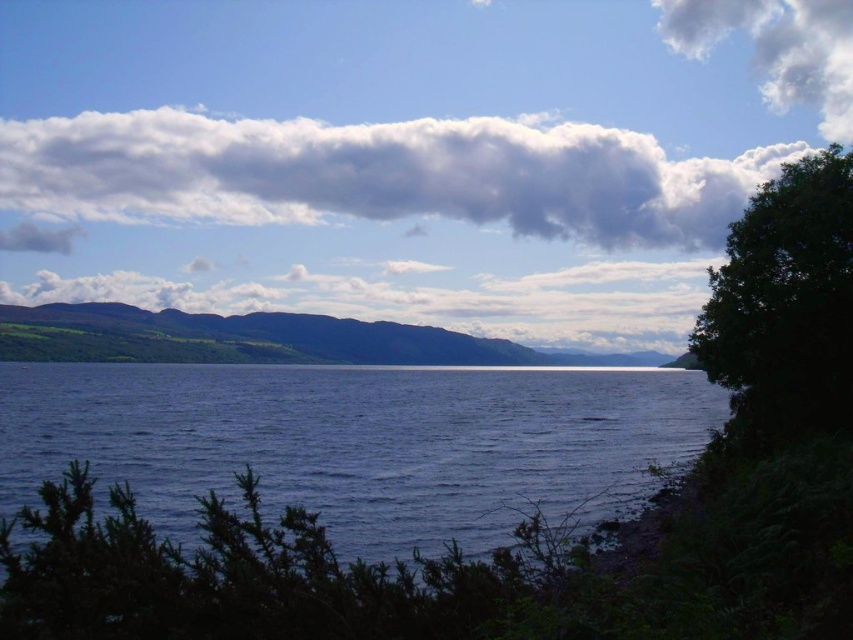
Who is positioned more to the left, cloudy sky at upper center or green leafy tree at right?

cloudy sky at upper center

Which of these two, cloudy sky at upper center or green leafy tree at right, stands taller?

With more height is cloudy sky at upper center.

Measure the distance between point (503,134) and camera.

Point (503,134) and camera are 1209.71 feet apart.

In order to click on cloudy sky at upper center in this screenshot , I will do `click(378, 173)`.

How distant is dark blue water at center from white fluffy cloud at upper right?

dark blue water at center and white fluffy cloud at upper right are 928.90 feet apart from each other.

From the picture: Between dark blue water at center and white fluffy cloud at upper right, which one is positioned higher?

white fluffy cloud at upper right is above.

Which is behind, point (334, 476) or point (840, 65)?

Positioned behind is point (840, 65).

Where is `dark blue water at center`? dark blue water at center is located at coordinates (358, 442).

Can you confirm if dark blue water at center is thinner than cloudy sky at upper center?

Indeed, dark blue water at center has a lesser width compared to cloudy sky at upper center.

What do you see at coordinates (358, 442) in the screenshot?
I see `dark blue water at center` at bounding box center [358, 442].

You are a GUI agent. You are given a task and a screenshot of the screen. Output one action in this format:
    pyautogui.click(x=<x>, y=<y>)
    Task: Click on the dark blue water at center
    The image size is (853, 640).
    Given the screenshot: What is the action you would take?
    pyautogui.click(x=358, y=442)